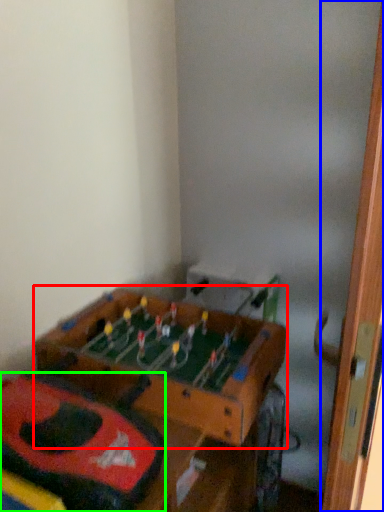
Question: Which is nearer to the table (highlighted by a red box)? door (highlighted by a blue box) or kit (highlighted by a green box).

Choices:
 (A) door
 (B) kit

Answer: (B)